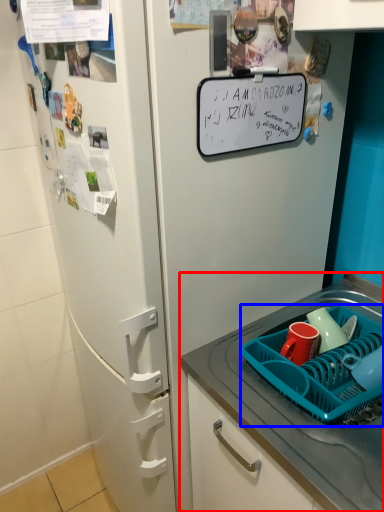
Question: Which object is further to the camera taking this photo, desk (highlighted by a red box) or basket (highlighted by a blue box)?

Choices:
 (A) desk
 (B) basket

Answer: (B)